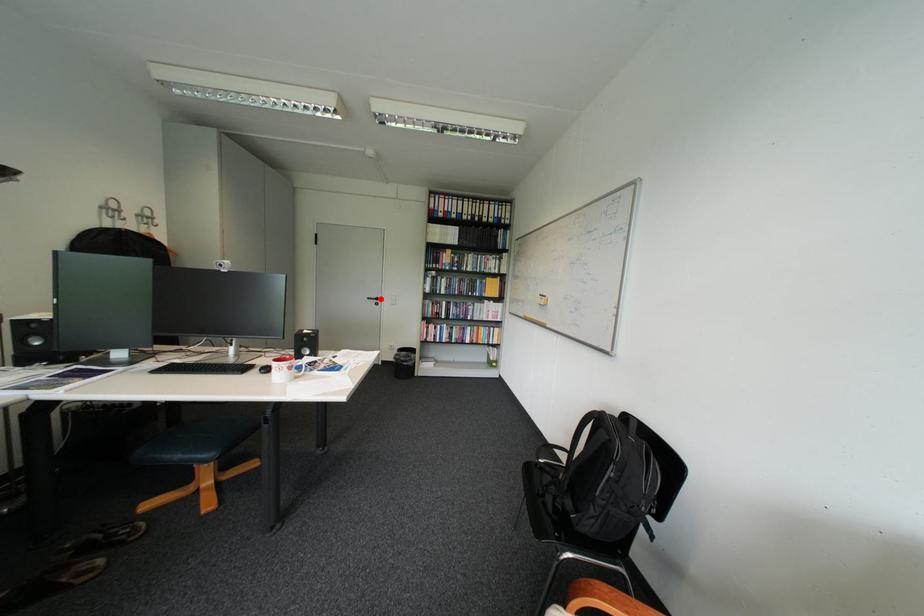
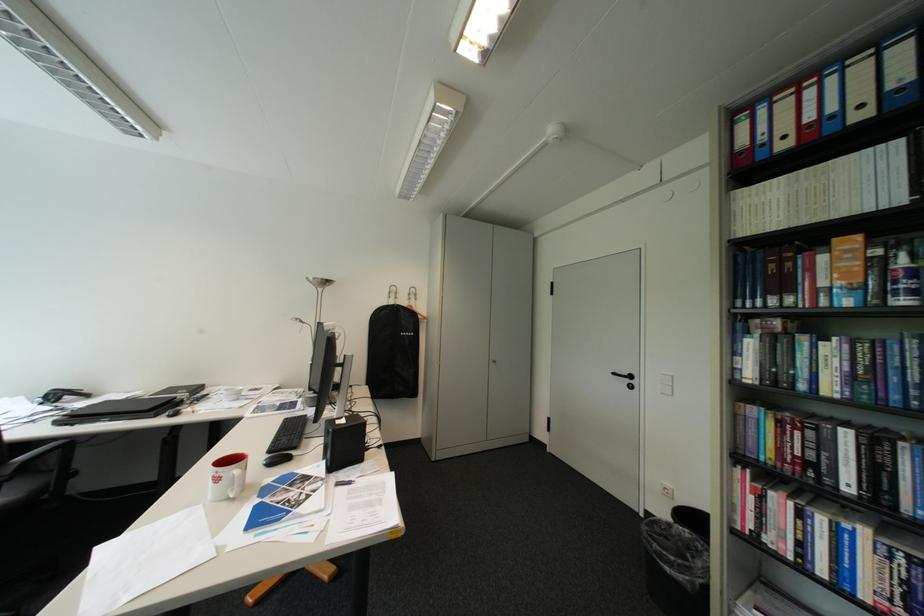
In the second image, find the point that corresponds to the highlighted location in the first image.

(626, 374)